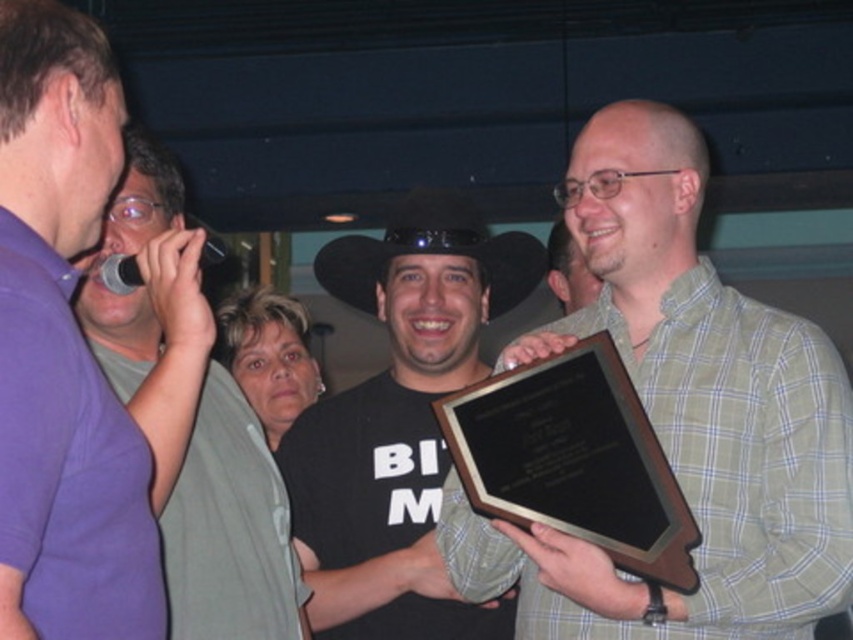
You are standing in the room and see the point at coordinates (697, 404). What object is located at that point?

The green plaid shirt at center is located at point (697, 404).

You are at a party and want to take a photo of both the black felt cowboy hat at center and the green plaid shirt at upper right. Which object should you focus on first to ensure both are in the frame?

You should focus on the black felt cowboy hat at center first since it is closer to the viewer than the green plaid shirt at upper right, ensuring both are in the frame.